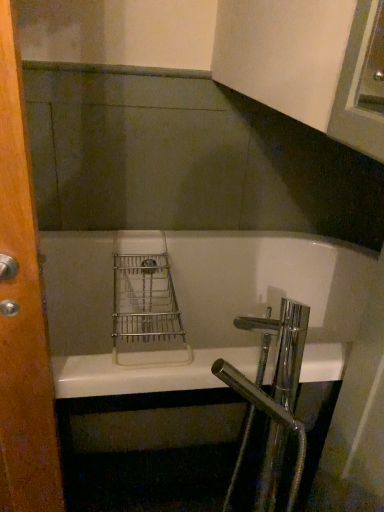
Question: Would you say wooden door at left contains chrome/metallic faucet at lower right?

Choices:
 (A) no
 (B) yes

Answer: (A)

Question: Is wooden door at left bigger than chrome/metallic faucet at lower right?

Choices:
 (A) no
 (B) yes

Answer: (A)

Question: Can you confirm if wooden door at left is thinner than chrome/metallic faucet at lower right?

Choices:
 (A) no
 (B) yes

Answer: (B)

Question: From the image's perspective, is wooden door at left on top of chrome/metallic faucet at lower right?

Choices:
 (A) no
 (B) yes

Answer: (B)

Question: Is wooden door at left facing towards chrome/metallic faucet at lower right?

Choices:
 (A) no
 (B) yes

Answer: (A)

Question: From their relative heights in the image, would you say wooden door at left is taller or shorter than chrome/metallic faucet at lower right?

Choices:
 (A) tall
 (B) short

Answer: (A)

Question: Does point (23, 407) appear closer or farther from the camera than point (271, 328)?

Choices:
 (A) closer
 (B) farther

Answer: (B)

Question: Considering the positions of wooden door at left and chrome/metallic faucet at lower right in the image, is wooden door at left bigger or smaller than chrome/metallic faucet at lower right?

Choices:
 (A) big
 (B) small

Answer: (B)

Question: From the image's perspective, relative to chrome/metallic faucet at lower right, is wooden door at left above or below?

Choices:
 (A) below
 (B) above

Answer: (B)

Question: Is white glossy bathtub at center taller or shorter than wooden door at left?

Choices:
 (A) tall
 (B) short

Answer: (B)

Question: In terms of width, does white glossy bathtub at center look wider or thinner when compared to wooden door at left?

Choices:
 (A) wide
 (B) thin

Answer: (A)

Question: From a real-world perspective, is white glossy bathtub at center above or below wooden door at left?

Choices:
 (A) below
 (B) above

Answer: (A)

Question: Relative to wooden door at left, is white glossy bathtub at center in front or behind?

Choices:
 (A) behind
 (B) front

Answer: (A)

Question: Choose the correct answer: Is chrome/metallic faucet at lower right inside wooden door at left or outside it?

Choices:
 (A) inside
 (B) outside

Answer: (B)

Question: Would you say chrome/metallic faucet at lower right is to the left or to the right of wooden door at left in the picture?

Choices:
 (A) right
 (B) left

Answer: (A)